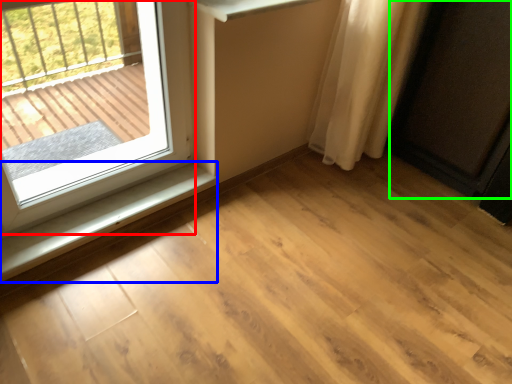
Question: Which is nearer to the window (highlighted by a red box)? window sill (highlighted by a blue box) or screen door (highlighted by a green box).

Choices:
 (A) window sill
 (B) screen door

Answer: (A)